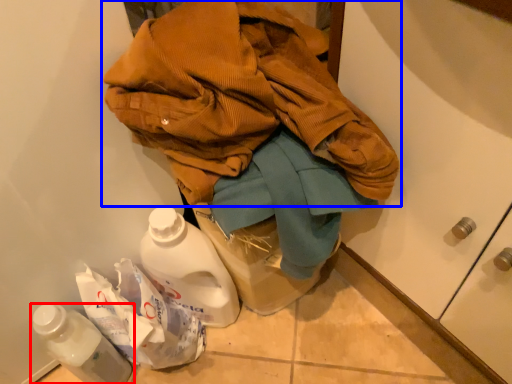
Question: Among these objects, which one is farthest to the camera, bottle (highlighted by a red box) or jacket (highlighted by a blue box)?

Choices:
 (A) bottle
 (B) jacket

Answer: (A)